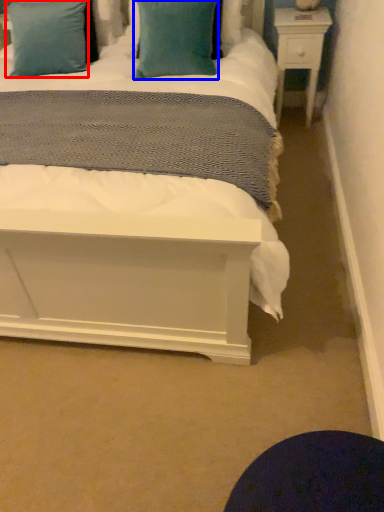
Question: Which of the following is the closest to the observer, pillow (highlighted by a red box) or pillow (highlighted by a blue box)?

Choices:
 (A) pillow
 (B) pillow

Answer: (B)